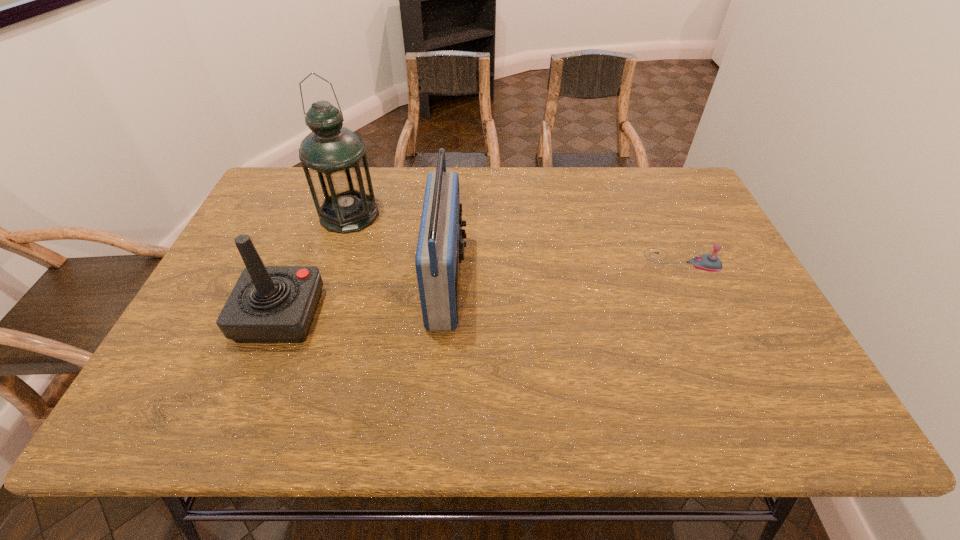
I want to click on free point located 0.190m on the left of the farther joystick, so click(x=576, y=260).

You are a GUI agent. You are given a task and a screenshot of the screen. Output one action in this format:
    pyautogui.click(x=<x>, y=<y>)
    Task: Click on the object located in the far edge section of the desktop
    The width and height of the screenshot is (960, 540).
    Given the screenshot: What is the action you would take?
    pyautogui.click(x=333, y=157)

Where is `object that is positioned at the left edge`? The width and height of the screenshot is (960, 540). object that is positioned at the left edge is located at coordinates (269, 304).

This screenshot has height=540, width=960. Find the location of `object at the right edge`. object at the right edge is located at coordinates (708, 262).

Find the location of `free region at the far edge`. free region at the far edge is located at coordinates (396, 167).

This screenshot has height=540, width=960. I want to click on vacant space at the near edge of the desktop, so click(x=665, y=430).

Find the location of `vacant space at the left edge of the desktop`. vacant space at the left edge of the desktop is located at coordinates (211, 319).

Find the location of a particular element. vacant space at the right edge of the desktop is located at coordinates (749, 338).

I want to click on vacant space at the far left corner of the desktop, so click(262, 211).

Find the location of a particular element. The width and height of the screenshot is (960, 540). free spot at the near right corner of the desktop is located at coordinates (804, 393).